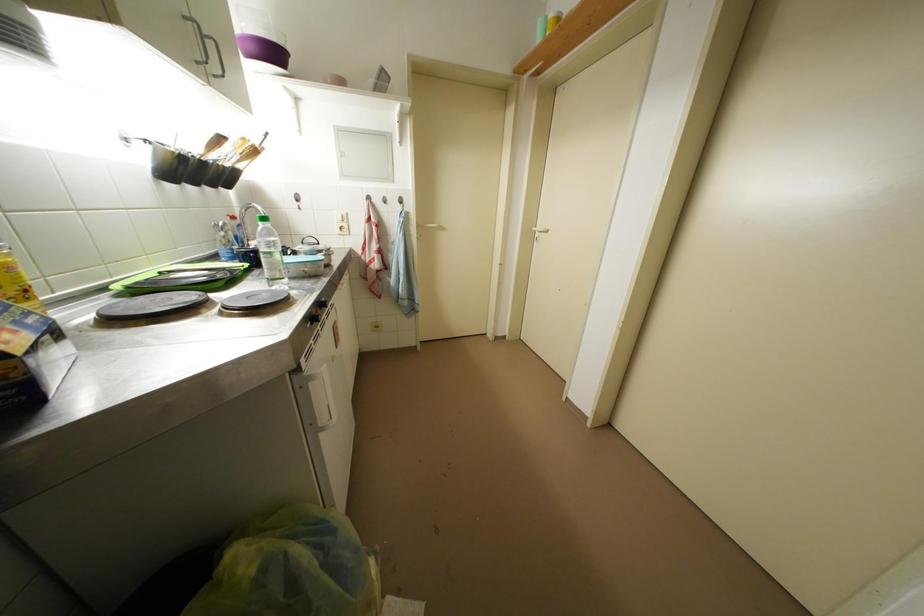
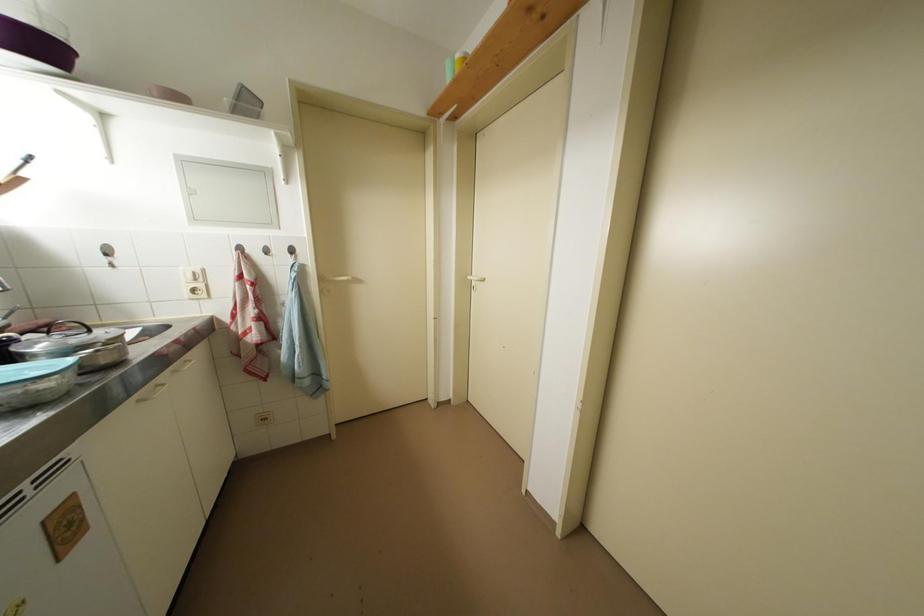
Question: The camera is either moving clockwise (left) or counter-clockwise (right) around the object. The first image is from the beginning of the video and the second image is from the end. Is the camera moving left or right when shooting the video?

Choices:
 (A) Left
 (B) Right

Answer: (A)